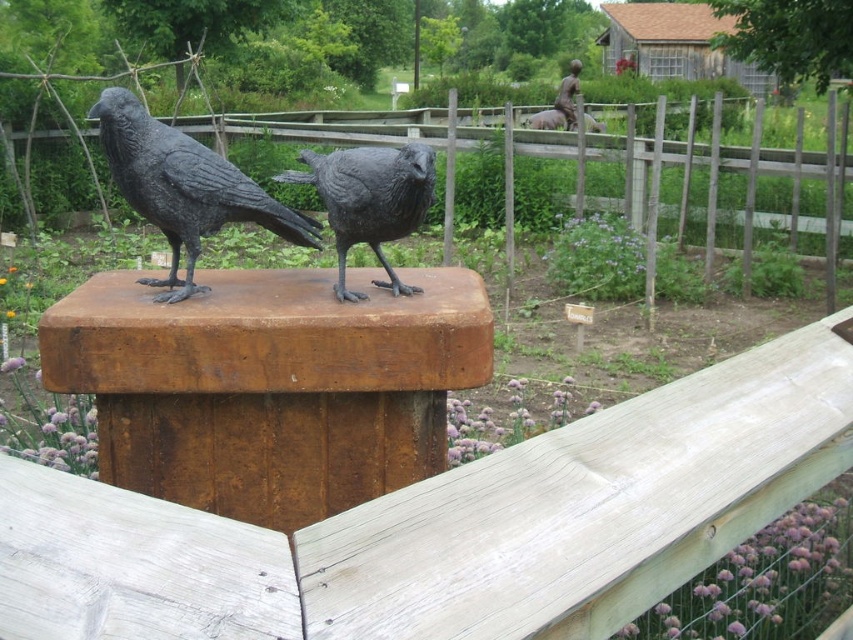
Question: Which point is closer to the camera?

Choices:
 (A) shiny black raven at center
 (B) wooden fence at center

Answer: (A)

Question: From the image, what is the correct spatial relationship of wooden fence at center in relation to shiny black raven at center?

Choices:
 (A) below
 (B) above

Answer: (B)

Question: Which point is farther to the camera?

Choices:
 (A) (531, 124)
 (B) (621, 140)
 (C) (343, 291)

Answer: (A)

Question: Which object appears farthest from the camera in this image?

Choices:
 (A) shiny black raven at center
 (B) matte black crow at center

Answer: (B)

Question: Is wooden fence at center below matte black crow at center?

Choices:
 (A) no
 (B) yes

Answer: (A)

Question: In this image, where is shiny black raven at center located relative to bronze statue at upper center?

Choices:
 (A) right
 (B) left

Answer: (B)